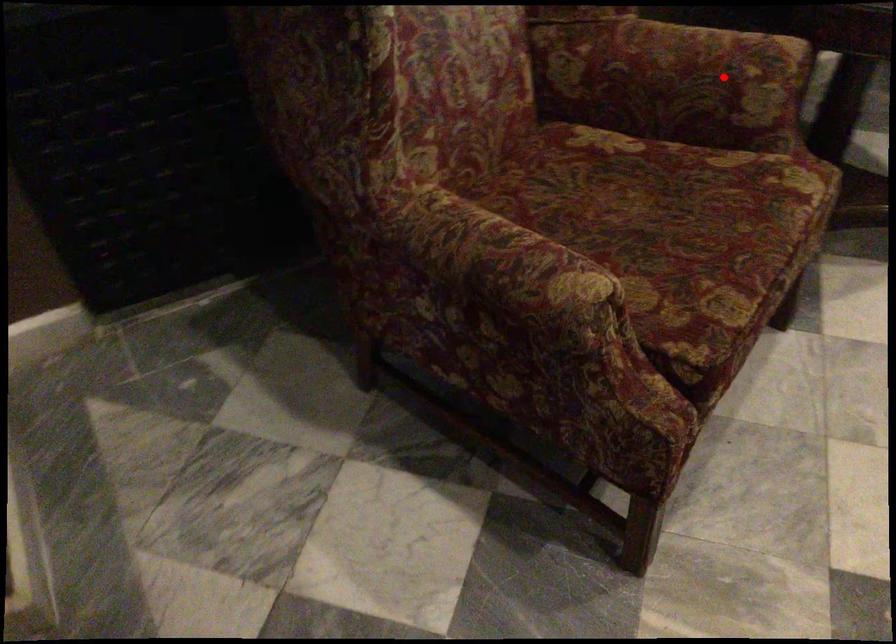
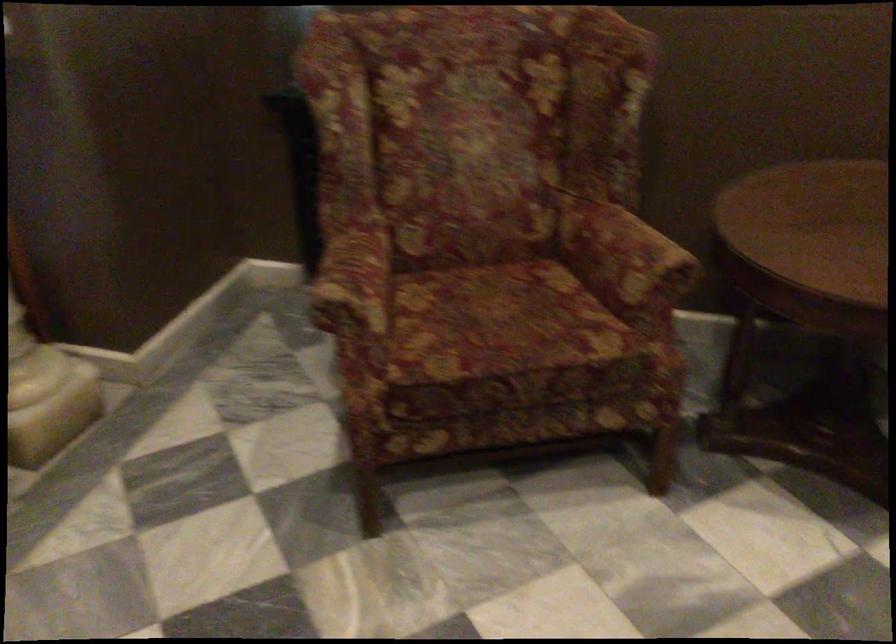
Find the pixel in the second image that matches the highlighted location in the first image.

(624, 258)